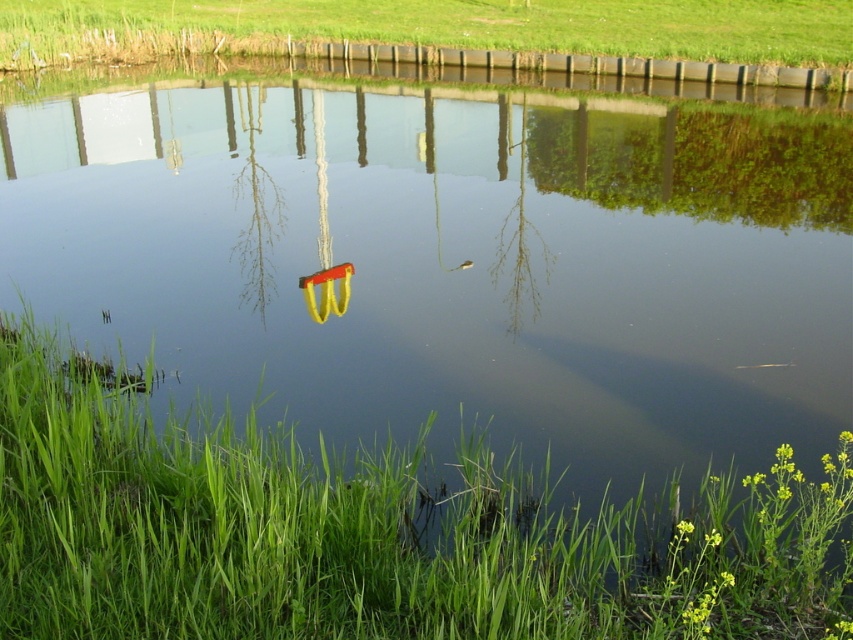
Does green grass at lower left lie in front of green grass at upper center?

That is True.

Based on the photo, is green grass at lower left smaller than green grass at upper center?

Correct, green grass at lower left occupies less space than green grass at upper center.

Who is more forward, [683,621] or [641,12]?

Point [683,621] is more forward.

At what (x,y) coordinates should I click in order to perform the action: click on green grass at lower left. Please return your answer as a coordinate pair (x, y). Looking at the image, I should click on (373, 532).